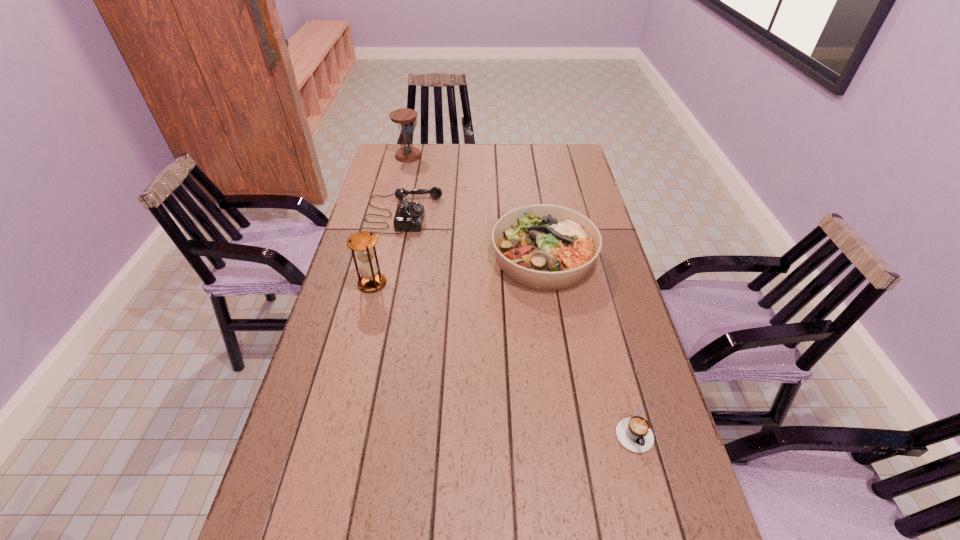
Find the location of `object that is the third closest to the salad plate`. object that is the third closest to the salad plate is located at coordinates (634, 433).

Choose which object is the second nearest neighbor to the telephone. Please provide its 2D coordinates. Your answer should be formatted as a tuple, i.e. [(x, y)], where the tuple contains the x and y coordinates of a point satisfying the conditions above.

[(363, 243)]

This screenshot has width=960, height=540. Identify the location of vacant space that satisfies the following two spatial constraints: 1. on the dial of the telephone; 2. on the left side of the salad plate. (394, 258).

The image size is (960, 540). I want to click on blank area in the image that satisfies the following two spatial constraints: 1. on the back side of the nearer hourglass; 2. on the left side of the farther hourglass, so click(404, 156).

Identify the location of vacant area in the image that satisfies the following two spatial constraints: 1. on the back side of the farthest object; 2. on the right side of the nearer hourglass. The width and height of the screenshot is (960, 540). (404, 156).